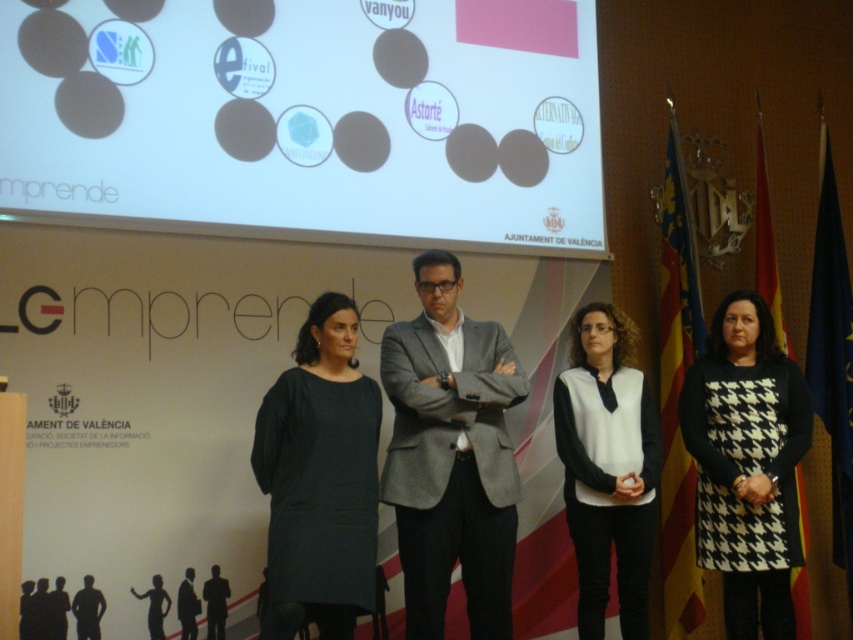
You are attending a conference at the City Hall of Valencia and notice two items of interest in the scene described. One is the white matte screen at upper center and the other is the dark gray dress at center. From your vantage point, which of these two items is positioned higher in the image?

The white matte screen at upper center is located above the dark gray dress at center, so it is positioned higher in the image.

You are sitting in the audience at the Emprende event at Ajuntament de Valenc... ica. You notice two presenters on stage wearing a dark gray dress at center and a white matte sweater at center. Which clothing item is positioned closer to you?

The dark gray dress at center is closer to the viewer than the white matte sweater at center, so the dark gray dress at center is positioned closer to you.

You are standing at the back of the conference hall and want to walk to the stage. There are two points marked on the floor in front of you. The first point is at coordinate point (347, 541) and the second point is at coordinate point (625, 524). Which point should you aim for to reach the stage faster?

Point (347, 541) is in front of point (625, 524), so you should aim for point (347, 541) to reach the stage faster since it is closer to you.